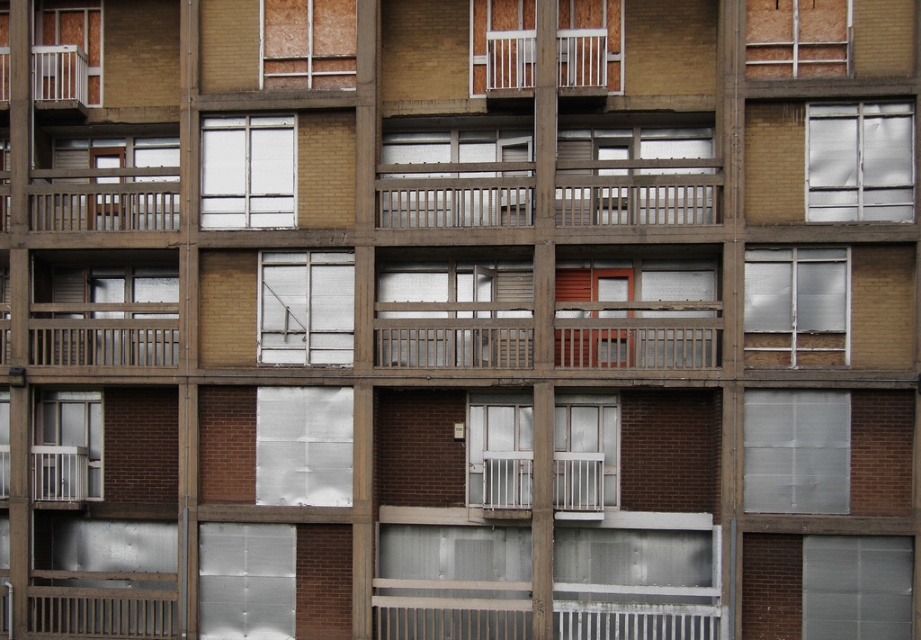
Question: Which point is farther from the camera taking this photo?

Choices:
 (A) (848, 456)
 (B) (901, 170)

Answer: (B)

Question: Which object is positioned closest to the transparent plastic window at lower right?

Choices:
 (A) wooden railing at upper left
 (B) clear glass door at center

Answer: (B)

Question: Is white textured paper at center in front of white frosted glass window at center?

Choices:
 (A) yes
 (B) no

Answer: (A)

Question: Considering the real-world distances, which object is farthest from the transparent plastic window at lower right?

Choices:
 (A) clear glass door at center
 (B) clear glass window at center
 (C) matte white window at lower left
 (D) white matte window at upper center

Answer: (C)

Question: Does transparent plastic window at lower right appear over matte white window at lower left?

Choices:
 (A) yes
 (B) no

Answer: (B)

Question: Is transparent plastic window at lower right to the left of wooden frame at upper center from the viewer's perspective?

Choices:
 (A) yes
 (B) no

Answer: (B)